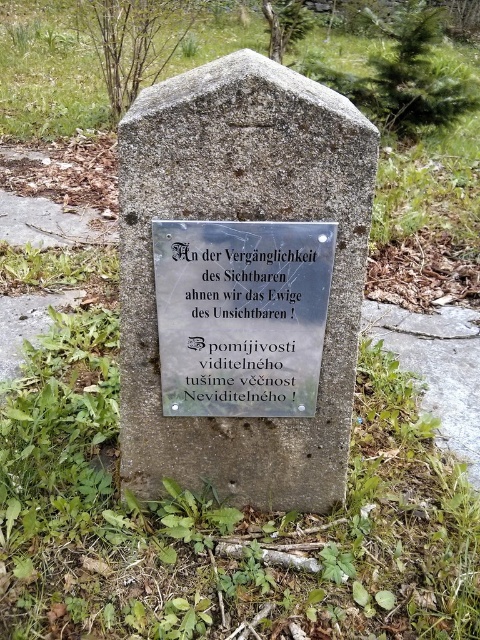
Question: Which point appears farthest from the camera in this image?

Choices:
 (A) (327, 273)
 (B) (40, 67)

Answer: (B)

Question: Which point appears closest to the camera in this image?

Choices:
 (A) tap(475, 179)
 (B) tap(361, 260)
 (C) tap(288, 310)

Answer: (B)

Question: Can you confirm if smooth stone gravestone at center is positioned above green grass at center?

Choices:
 (A) yes
 (B) no

Answer: (B)

Question: Is green grass at center smaller than silver metallic plaque at center?

Choices:
 (A) yes
 (B) no

Answer: (B)

Question: Estimate the real-world distances between objects in this image. Which object is closer to the green grass at center?

Choices:
 (A) silver metallic plaque at center
 (B) smooth stone gravestone at center

Answer: (A)

Question: Can you confirm if smooth stone gravestone at center is wider than green grass at center?

Choices:
 (A) no
 (B) yes

Answer: (A)